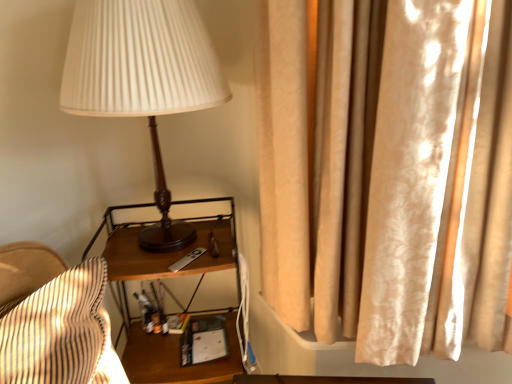
What is the approximate height of wooden nightstand at center?

wooden nightstand at center is 29.81 inches tall.

Where is `matte wood lamp at center`? The width and height of the screenshot is (512, 384). matte wood lamp at center is located at coordinates (143, 79).

The width and height of the screenshot is (512, 384). What are the coordinates of `silky beige curtain at right` in the screenshot? It's located at (389, 175).

Based on the photo, can we say matte wood lamp at center lies outside wooden nightstand at center?

Yes, matte wood lamp at center is located beyond the bounds of wooden nightstand at center.

At what (x,y) coordinates should I click in order to perform the action: click on nightstand on the right of matte wood lamp at center. Please return your answer as a coordinate pair (x, y). This screenshot has width=512, height=384. Looking at the image, I should click on pos(163,278).

In the image, is matte wood lamp at center on the left side or the right side of wooden nightstand at center?

From the image, it's evident that matte wood lamp at center is to the left of wooden nightstand at center.

Relative to wooden nightstand at center, is matte wood lamp at center in front or behind?

Visually, matte wood lamp at center is located in front of wooden nightstand at center.

How far apart are silky beige curtain at right and matte wood lamp at center?

42.06 centimeters.

Between silky beige curtain at right and matte wood lamp at center, which one appears on the left side from the viewer's perspective?

Positioned to the left is matte wood lamp at center.

In terms of height, does silky beige curtain at right look taller or shorter compared to matte wood lamp at center?

Clearly, silky beige curtain at right is taller compared to matte wood lamp at center.

Based on the photo, choose the correct answer: Is silky beige curtain at right inside matte wood lamp at center or outside it?

silky beige curtain at right exists outside the volume of matte wood lamp at center.

Which is behind, point (88, 101) or point (409, 333)?

Positioned behind is point (409, 333).

Is matte wood lamp at center positioned far away from silky beige curtain at right?

No, there isn't a large distance between matte wood lamp at center and silky beige curtain at right.

Considering the relative sizes of matte wood lamp at center and silky beige curtain at right in the image provided, is matte wood lamp at center bigger than silky beige curtain at right?

Incorrect, matte wood lamp at center is not larger than silky beige curtain at right.

From the image's perspective, is matte wood lamp at center below silky beige curtain at right?

No.

Based on the photo, is wooden nightstand at center at the back of silky beige curtain at right?

No.

From the picture: Is silky beige curtain at right bigger or smaller than wooden nightstand at center?

In the image, silky beige curtain at right appears to be smaller than wooden nightstand at center.

In the scene shown: Which of these two, silky beige curtain at right or wooden nightstand at center, is wider?

With larger width is wooden nightstand at center.

In the image, is wooden nightstand at center positioned in front of or behind matte wood lamp at center?

Clearly, wooden nightstand at center is behind matte wood lamp at center.

Choose the correct answer: Is wooden nightstand at center inside matte wood lamp at center or outside it?

wooden nightstand at center lies outside matte wood lamp at center.

Does point (96, 236) appear closer or farther from the camera than point (210, 67)?

Clearly, point (96, 236) is more distant from the camera than point (210, 67).

This screenshot has width=512, height=384. What are the coordinates of `nightstand lying behind the silky beige curtain at right` in the screenshot? It's located at (163, 278).

Is wooden nightstand at center taller or shorter than silky beige curtain at right?

In the image, wooden nightstand at center appears to be shorter than silky beige curtain at right.

Which object is thinner, wooden nightstand at center or silky beige curtain at right?

Thinner between the two is silky beige curtain at right.

Based on the photo, is silky beige curtain at right surrounded by wooden nightstand at center?

No.

The width and height of the screenshot is (512, 384). I want to click on lamp in front of the wooden nightstand at center, so click(x=143, y=79).

Locate an element on the screen. This screenshot has height=384, width=512. curtain that appears on the right of matte wood lamp at center is located at coordinates click(x=389, y=175).

When comparing their distances from wooden nightstand at center, does silky beige curtain at right or matte wood lamp at center seem closer?

The object closer to wooden nightstand at center is silky beige curtain at right.

Considering their positions, is wooden nightstand at center positioned closer to matte wood lamp at center than silky beige curtain at right?

Among the two, silky beige curtain at right is located nearer to matte wood lamp at center.

Which object lies nearer to the anchor point silky beige curtain at right, wooden nightstand at center or matte wood lamp at center?

The object closer to silky beige curtain at right is matte wood lamp at center.

From the image, which object appears to be nearer to matte wood lamp at center, silky beige curtain at right or wooden nightstand at center?

silky beige curtain at right is closer to matte wood lamp at center.

Based on their spatial positions, is matte wood lamp at center or wooden nightstand at center closer to silky beige curtain at right?

matte wood lamp at center is positioned closer to the anchor silky beige curtain at right.

Based on their spatial positions, is matte wood lamp at center or silky beige curtain at right further from wooden nightstand at center?

matte wood lamp at center.

What are the coordinates of `nightstand situated between matte wood lamp at center and silky beige curtain at right from left to right` in the screenshot? It's located at (163, 278).